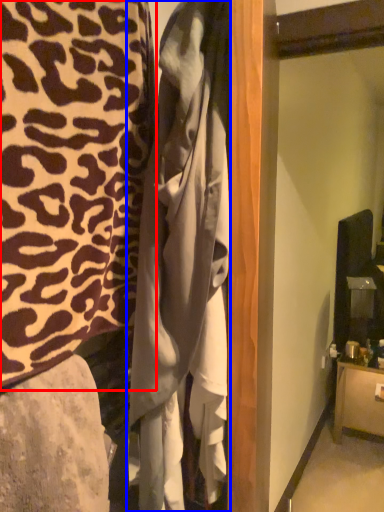
Question: Which point is closer to the camera, furniture (highlighted by a red box) or clothing (highlighted by a blue box)?

Choices:
 (A) furniture
 (B) clothing

Answer: (A)